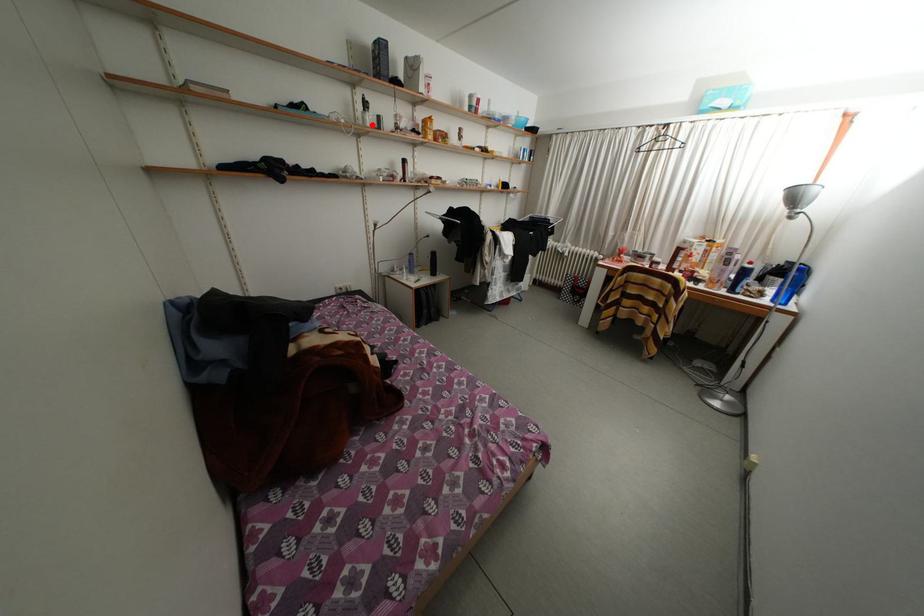
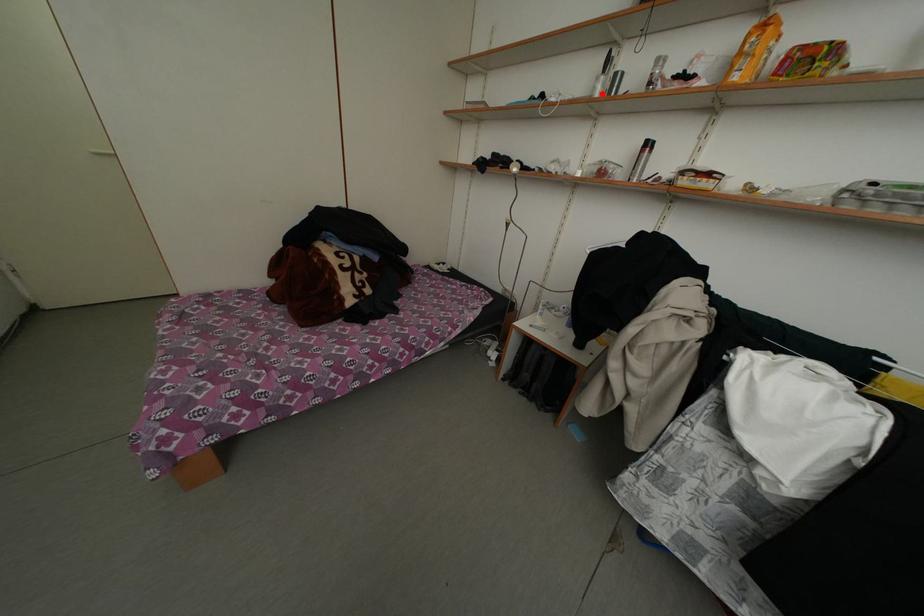
I am providing you with two images of the same scene from different viewpoints. A red point is marked on the first image and another point is marked on the second image. Is the red point in image1 aligned with the point shown in image2?

Yes